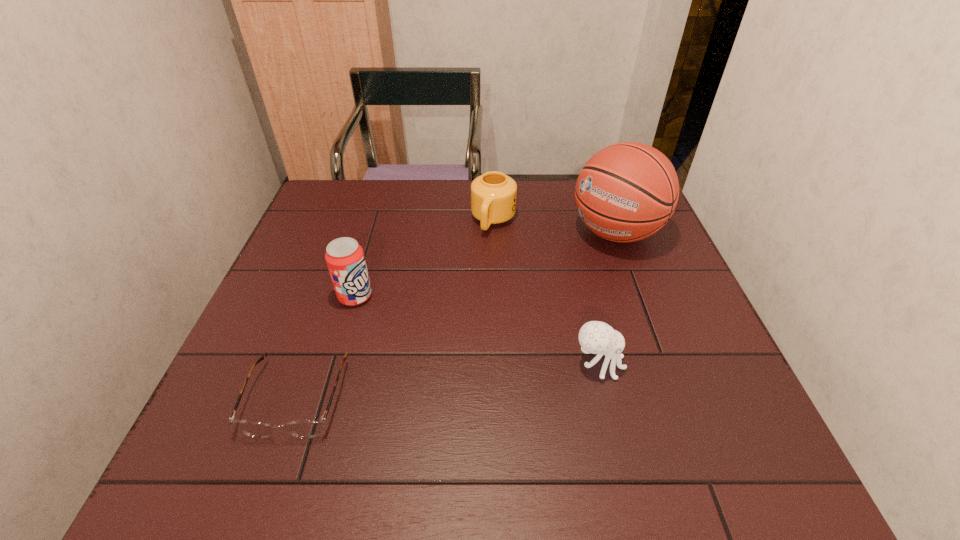
The height and width of the screenshot is (540, 960). Identify the location of vacant position located on the handle side of the third object from left to right. (471, 278).

Where is `vacant point located 0.130m on the handle side of the third object from left to right`? vacant point located 0.130m on the handle side of the third object from left to right is located at coordinates (475, 268).

Locate an element on the screen. vacant space located on the handle side of the third object from left to right is located at coordinates (482, 251).

At what (x,y) coordinates should I click in order to perform the action: click on vacant space located on the logo side of the tallest object. Please return your answer as a coordinate pair (x, y). This screenshot has height=540, width=960. Looking at the image, I should click on (575, 264).

The image size is (960, 540). Find the location of `free space located 0.380m on the logo side of the tallest object`. free space located 0.380m on the logo side of the tallest object is located at coordinates (492, 328).

Image resolution: width=960 pixels, height=540 pixels. Find the location of `vacant space positioned 0.200m on the logo side of the tallest object`. vacant space positioned 0.200m on the logo side of the tallest object is located at coordinates (541, 289).

The width and height of the screenshot is (960, 540). I want to click on mug located at the far edge, so click(493, 195).

Where is `basketball positioned at the far edge`? The height and width of the screenshot is (540, 960). basketball positioned at the far edge is located at coordinates (626, 192).

Where is `object located in the near edge section of the desktop`? The width and height of the screenshot is (960, 540). object located in the near edge section of the desktop is located at coordinates (308, 428).

At what (x,y) coordinates should I click in order to perform the action: click on object that is at the left edge. Please return your answer as a coordinate pair (x, y). Looking at the image, I should click on (308, 428).